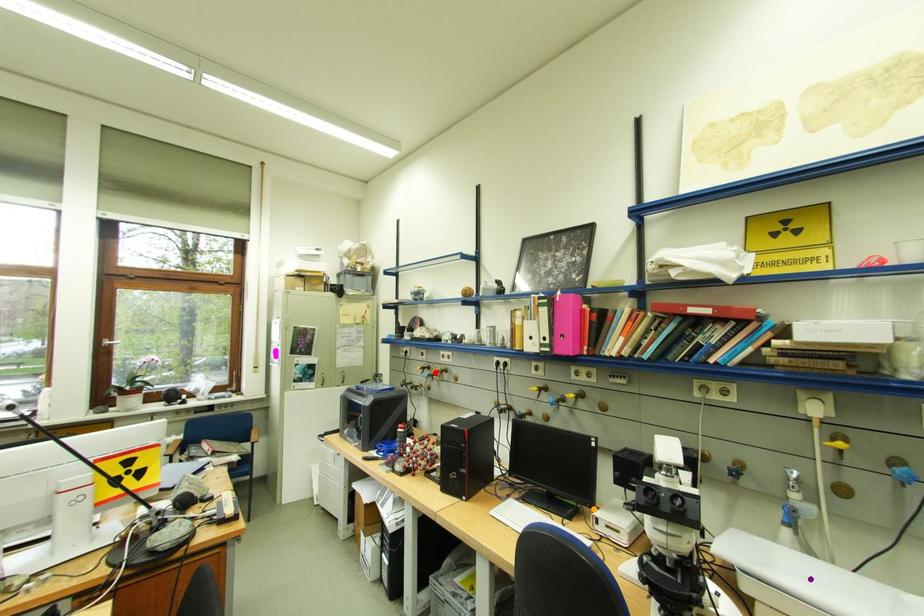
Order these from farthest to nearest:
1. orange point
2. red point
3. purple point

red point, orange point, purple point